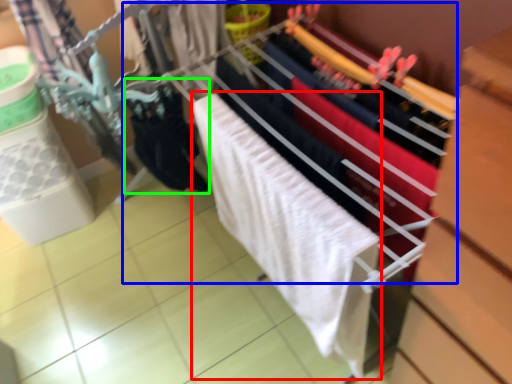
Question: Which object is the closest to the bath towel (highlighted by a red box)? Choose among these: closet (highlighted by a blue box) or clothing (highlighted by a green box).

Choices:
 (A) closet
 (B) clothing

Answer: (A)